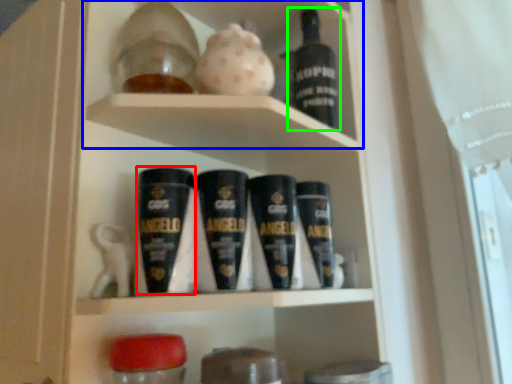
Question: Estimate the real-world distances between objects in this image. Which object is farther from shaving cream (highlighted by a red box), cabinet (highlighted by a blue box) or bottle (highlighted by a green box)?

Choices:
 (A) cabinet
 (B) bottle

Answer: (B)